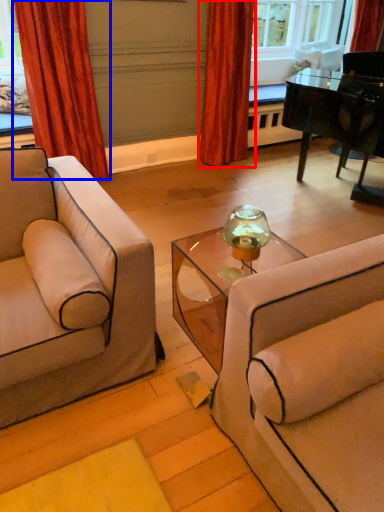
Question: Which object is closer to the camera taking this photo, curtain (highlighted by a red box) or curtain (highlighted by a blue box)?

Choices:
 (A) curtain
 (B) curtain

Answer: (B)